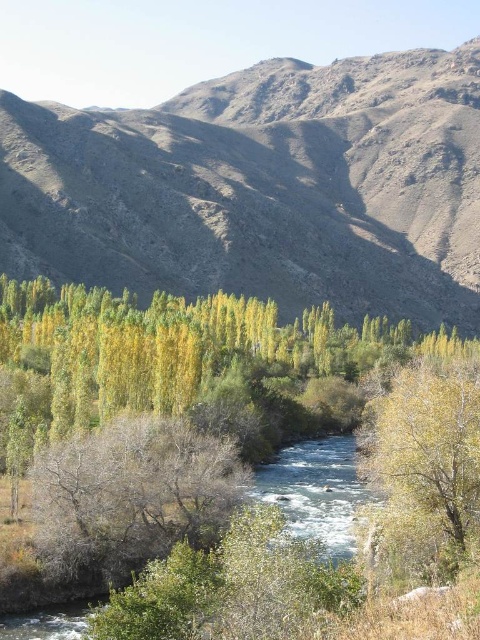
Question: Among these objects, which one is nearest to the camera?

Choices:
 (A) yellow-green leafy tree at center-right
 (B) clear water at center
 (C) rugged brown mountain at center

Answer: (B)

Question: Is rugged brown mountain at center positioned behind bare branches at center?

Choices:
 (A) no
 (B) yes

Answer: (B)

Question: Which point is farther to the camera?

Choices:
 (A) bare branches at center
 (B) yellow-green leafy tree at center-right
 (C) clear water at center
 (D) rugged brown mountain at center

Answer: (D)

Question: Does bare branches at center appear under clear water at center?

Choices:
 (A) no
 (B) yes

Answer: (A)

Question: Among these points, which one is farthest from the camera?

Choices:
 (A) pos(288,451)
 (B) pos(440,525)

Answer: (A)

Question: Observing the image, what is the correct spatial positioning of bare branches at center in reference to yellow-green leafy tree at center-right?

Choices:
 (A) above
 (B) below

Answer: (B)